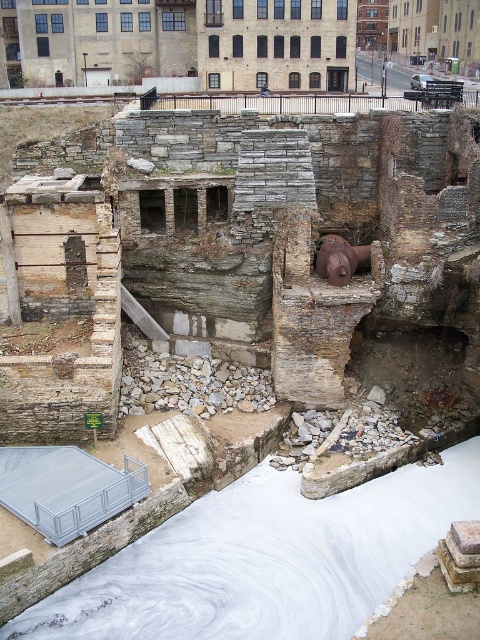
In the scene shown: You are a safety inspector assessing the site. You need to determine if the distance between the rusty stone ruins at center and the white smooth water at center is sufficient to prevent erosion damage. The minimum safe distance required is 15 meters. Is the current distance adequate?

The rusty stone ruins at center and white smooth water at center are 17.75 meters apart from each other. Since 17.75 meters exceeds the minimum safe distance of 15 meters, the current distance is adequate to prevent erosion damage.

You are standing at the point marked as point (240, 248) in the image of the industrial ruin. What type of surface are you currently standing on?

You are standing on rusty stone ruins at center.

You are a photographer planning to capture the interaction between the rusty stone ruins at center and the white smooth water at center. Based on their positions, which object is located to the left when focusing on the center of the image?

The rusty stone ruins at center is positioned on the left side of white smooth water at center, so it is located to the left when focusing on the center of the image.